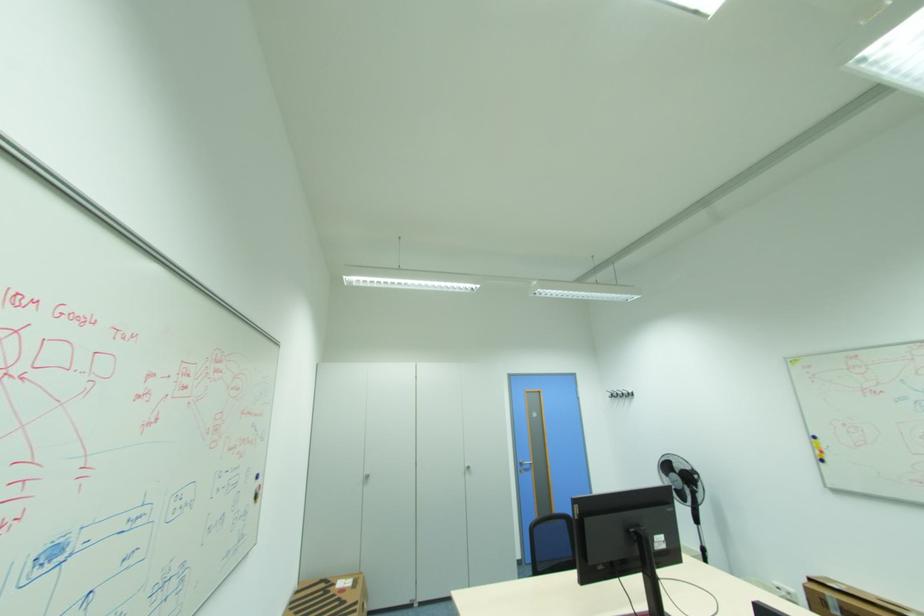
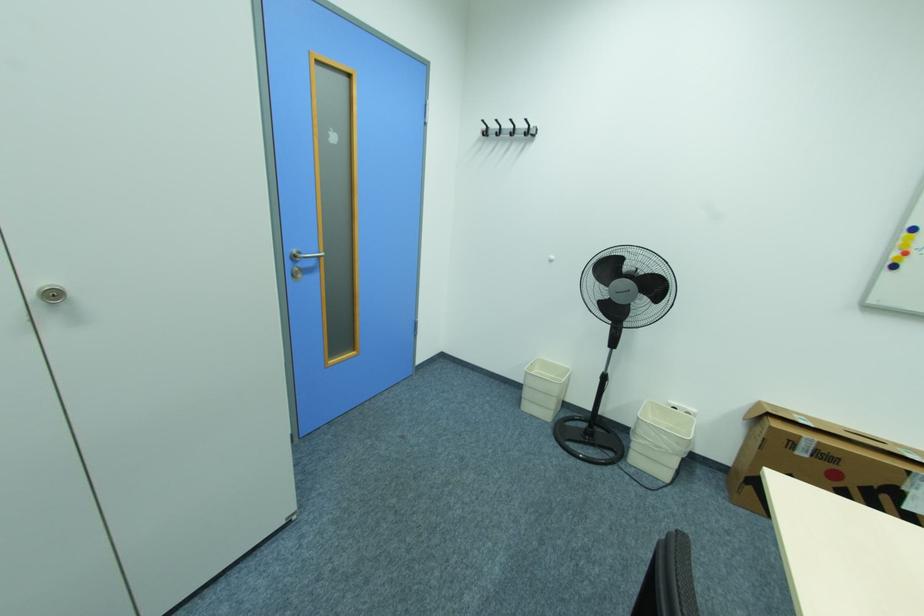
The point at (475, 468) is marked in the first image. Where is the corresponding point in the second image?

(64, 294)